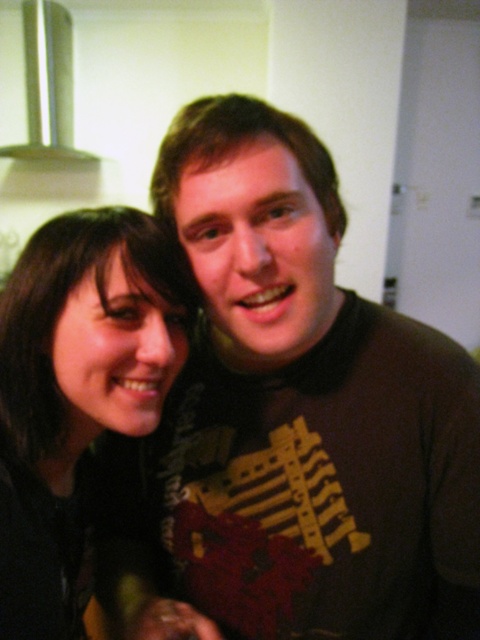
Question: Does dark brown t-shirt at center appear on the right side of black matte hair at left?

Choices:
 (A) no
 (B) yes

Answer: (B)

Question: Is dark brown t-shirt at center bigger than black matte hair at left?

Choices:
 (A) no
 (B) yes

Answer: (B)

Question: Estimate the real-world distances between objects in this image. Which object is closer to the dark brown t-shirt at center?

Choices:
 (A) silver metallic exhaust hood at upper left
 (B) black matte hair at left

Answer: (B)

Question: Considering the real-world distances, which object is closest to the black matte hair at left?

Choices:
 (A) dark brown t-shirt at center
 (B) silver metallic exhaust hood at upper left

Answer: (A)

Question: Does dark brown t-shirt at center appear on the left side of silver metallic exhaust hood at upper left?

Choices:
 (A) yes
 (B) no

Answer: (B)

Question: Among these objects, which one is nearest to the camera?

Choices:
 (A) dark brown t-shirt at center
 (B) silver metallic exhaust hood at upper left

Answer: (A)